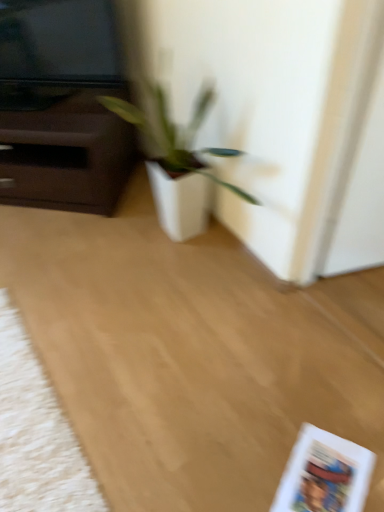
Question: Does white fluffy mat at lower left contain white matte paperback book at lower right?

Choices:
 (A) no
 (B) yes

Answer: (A)

Question: Considering the relative sizes of white fluffy mat at lower left and white matte paperback book at lower right in the image provided, is white fluffy mat at lower left thinner than white matte paperback book at lower right?

Choices:
 (A) no
 (B) yes

Answer: (A)

Question: Is white fluffy mat at lower left looking in the opposite direction of white matte paperback book at lower right?

Choices:
 (A) yes
 (B) no

Answer: (B)

Question: Is the position of white fluffy mat at lower left less distant than that of white matte paperback book at lower right?

Choices:
 (A) yes
 (B) no

Answer: (A)

Question: From a real-world perspective, is white fluffy mat at lower left physically above white matte paperback book at lower right?

Choices:
 (A) yes
 (B) no

Answer: (A)

Question: In terms of width, does white matte plant pot at center look wider or thinner when compared to white matte pot at center?

Choices:
 (A) wide
 (B) thin

Answer: (A)

Question: From a real-world perspective, is white matte plant pot at center positioned above or below white matte pot at center?

Choices:
 (A) above
 (B) below

Answer: (B)

Question: Visually, is white matte plant pot at center positioned to the left or to the right of white matte pot at center?

Choices:
 (A) left
 (B) right

Answer: (A)

Question: Relative to white matte pot at center, is white matte plant pot at center in front or behind?

Choices:
 (A) behind
 (B) front

Answer: (B)

Question: From a real-world perspective, is white matte paperback book at lower right physically located above or below white fluffy mat at lower left?

Choices:
 (A) above
 (B) below

Answer: (B)

Question: In terms of height, does white matte paperback book at lower right look taller or shorter compared to white fluffy mat at lower left?

Choices:
 (A) short
 (B) tall

Answer: (A)

Question: Is white matte paperback book at lower right wider or thinner than white fluffy mat at lower left?

Choices:
 (A) wide
 (B) thin

Answer: (B)

Question: Visually, is white matte paperback book at lower right positioned to the left or to the right of white fluffy mat at lower left?

Choices:
 (A) right
 (B) left

Answer: (A)

Question: Based on their positions, is white matte paperback book at lower right located to the left or right of white matte plant pot at center?

Choices:
 (A) left
 (B) right

Answer: (B)

Question: Considering the positions of white matte paperback book at lower right and white matte plant pot at center in the image, is white matte paperback book at lower right wider or thinner than white matte plant pot at center?

Choices:
 (A) wide
 (B) thin

Answer: (B)